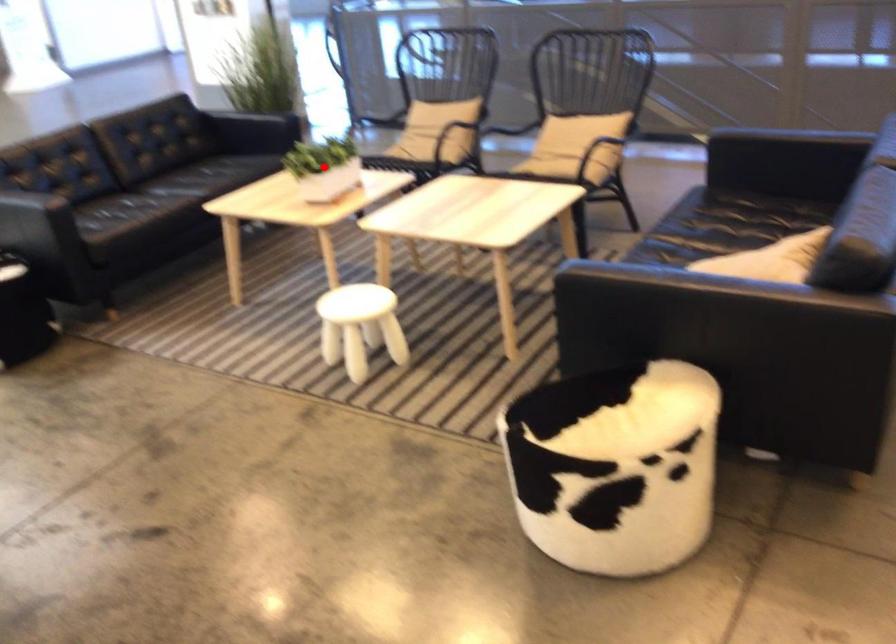
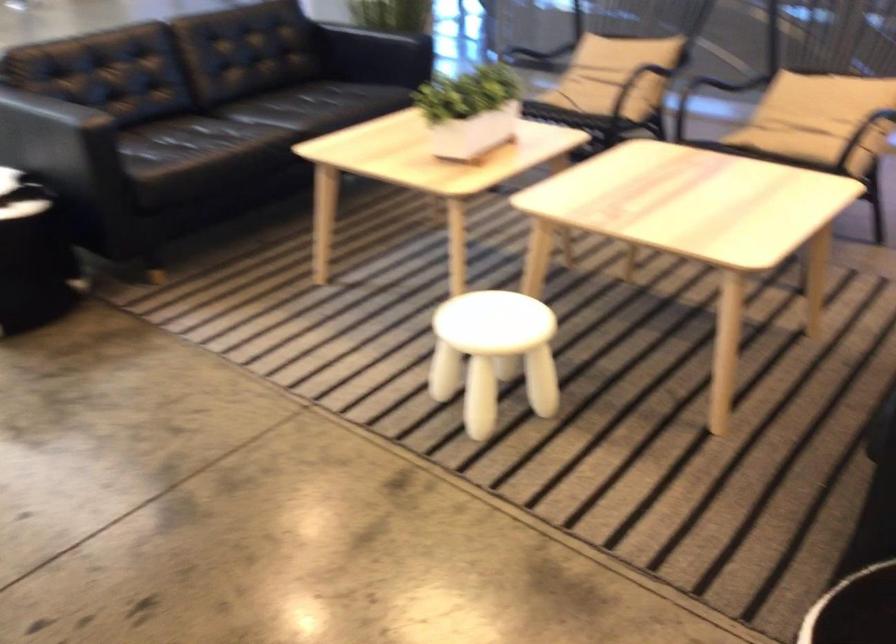
Question: A red point is marked in image1. In image2, is the corresponding 3D point closer to the camera or farther? Reply with the corresponding letter.

Choices:
 (A) The corresponding 3D point is closer.
 (B) The corresponding 3D point is farther.

Answer: (A)